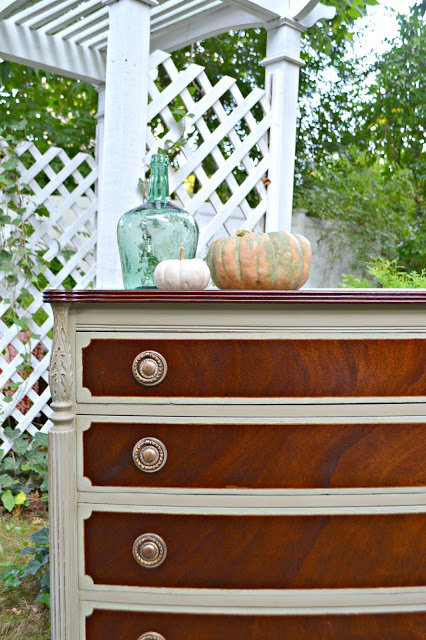
Identify the location of glass jug. Image resolution: width=426 pixels, height=640 pixels. (152, 216).